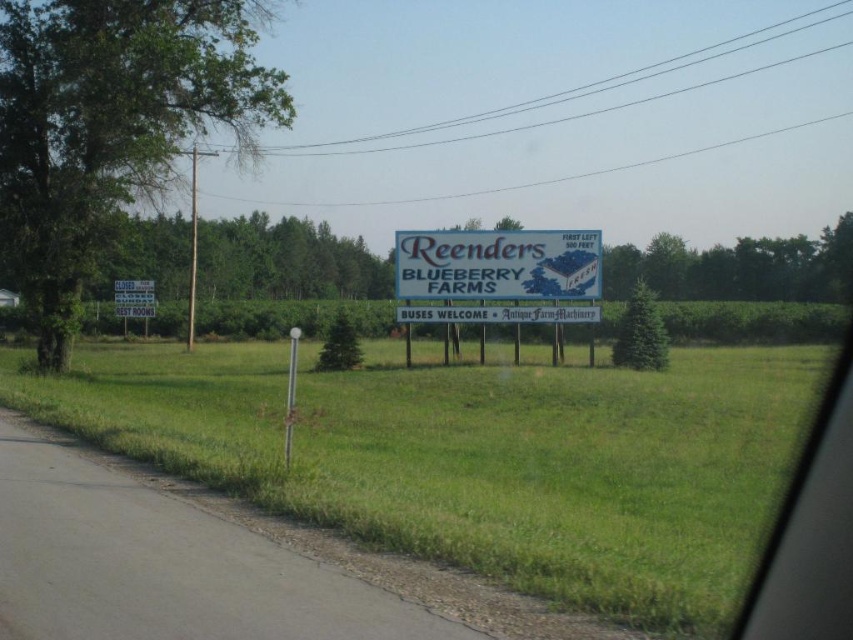
Can you confirm if transparent glass car window at center is bigger than white plastic sign at center?

Incorrect, transparent glass car window at center is not larger than white plastic sign at center.

Can you confirm if transparent glass car window at center is thinner than white plastic sign at center?

Yes, transparent glass car window at center is thinner than white plastic sign at center.

This screenshot has height=640, width=853. I want to click on transparent glass car window at center, so click(810, 532).

Image resolution: width=853 pixels, height=640 pixels. Identify the location of transparent glass car window at center. (810, 532).